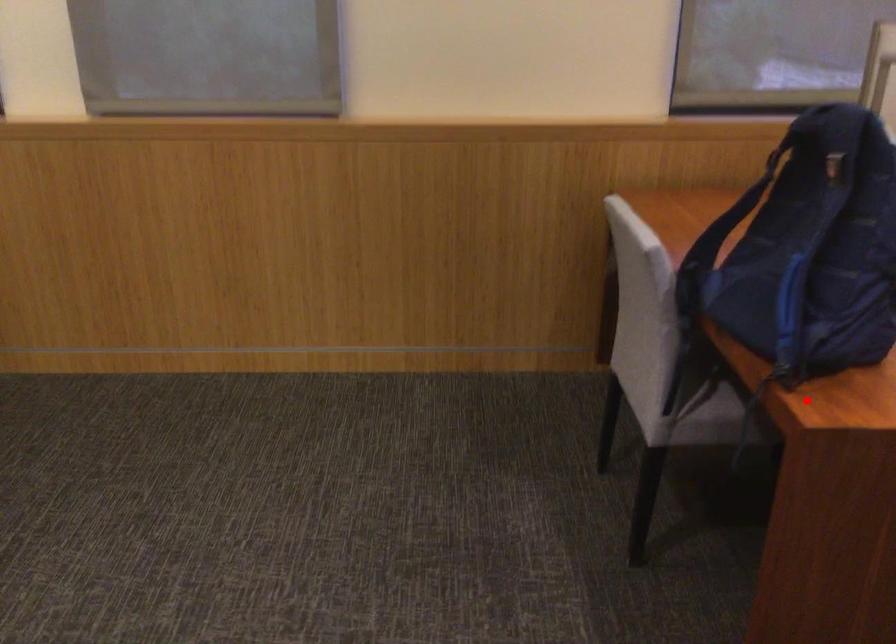
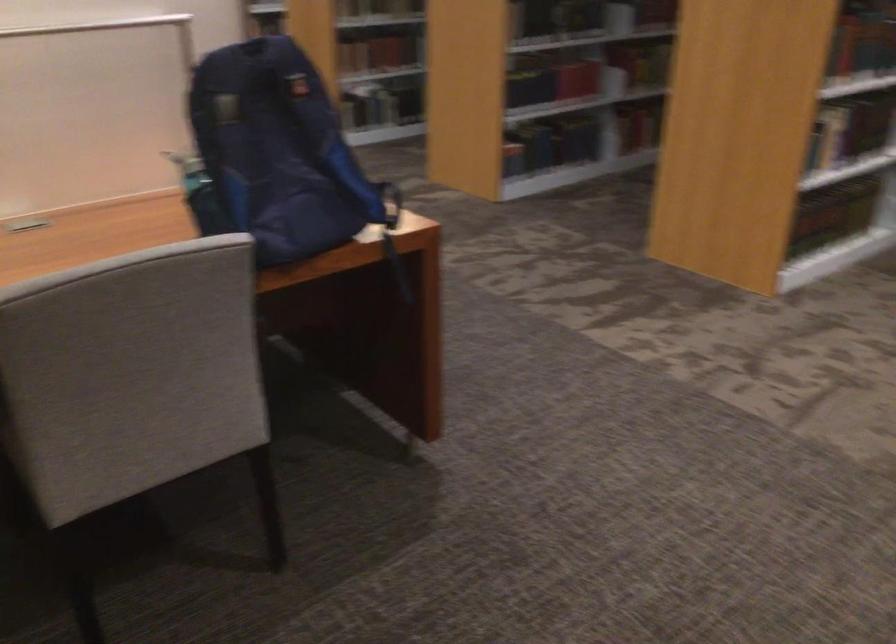
Locate, in the second image, the point that corresponds to the highlighted location in the first image.

(392, 234)